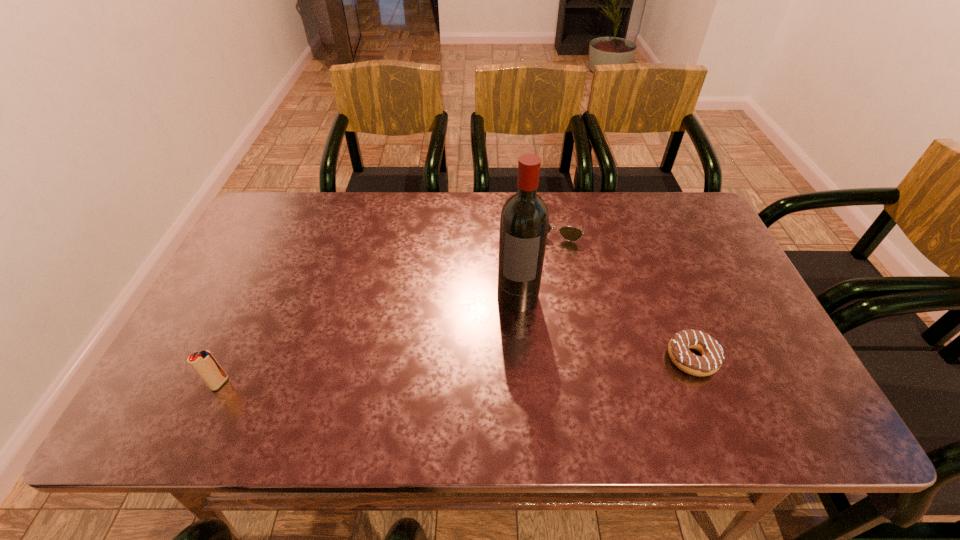
Where is `vacant spot on the desktop that is between the igniter and the doughnut and is positioned on the label of the wine bottle`? The width and height of the screenshot is (960, 540). vacant spot on the desktop that is between the igniter and the doughnut and is positioned on the label of the wine bottle is located at coordinates (509, 368).

The image size is (960, 540). I want to click on vacant space on the desktop that is between the third shortest object and the shortest object and is positioned on the front-facing side of the second shortest object, so click(x=519, y=367).